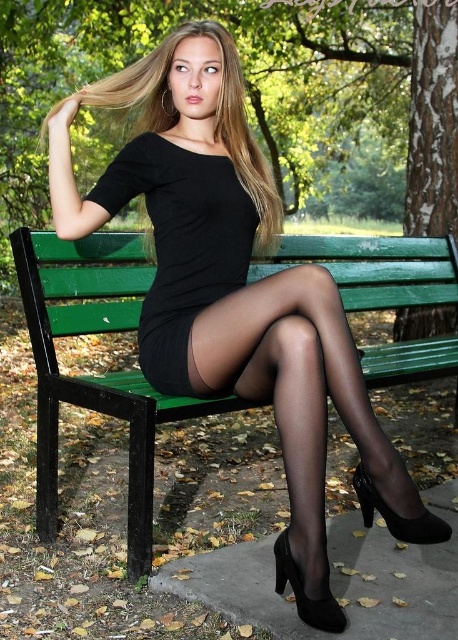
Question: Which object appears closest to the camera in this image?

Choices:
 (A) blonde silky hair at upper center
 (B) black sheer stocking at lower center

Answer: (B)

Question: Which object appears farthest from the camera in this image?

Choices:
 (A) black sheer tights at center
 (B) black matte dress at center
 (C) blonde silky hair at upper center
 (D) black sheer stocking at lower center

Answer: (C)

Question: Does blonde silky hair at upper center appear on the right side of black sheer stocking at lower center?

Choices:
 (A) no
 (B) yes

Answer: (A)

Question: Can you confirm if black sheer tights at center is thinner than black matte dress at center?

Choices:
 (A) no
 (B) yes

Answer: (A)

Question: Which object appears closest to the camera in this image?

Choices:
 (A) black sheer tights at center
 (B) black matte dress at center
 (C) blonde silky hair at upper center
 (D) black sheer stocking at lower center

Answer: (D)

Question: Does blonde silky hair at upper center have a lesser width compared to black sheer stocking at lower center?

Choices:
 (A) no
 (B) yes

Answer: (A)